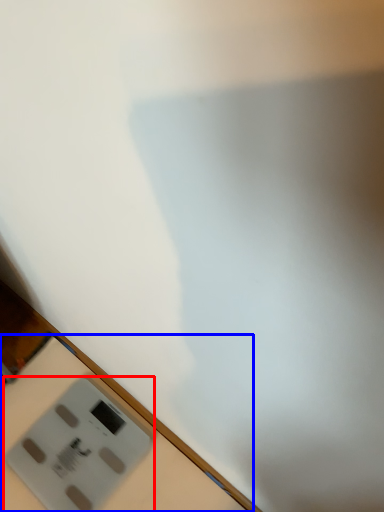
Question: Among these objects, which one is farthest to the camera, power plugs and sockets (highlighted by a red box) or table (highlighted by a blue box)?

Choices:
 (A) power plugs and sockets
 (B) table

Answer: (A)